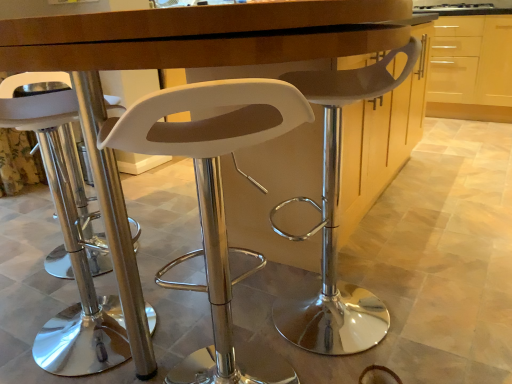
Locate an element on the screen. Image resolution: width=512 pixels, height=384 pixels. unoccupied space behind white plastic stool at center, acting as the 2th chair starting from the left is located at coordinates (213, 324).